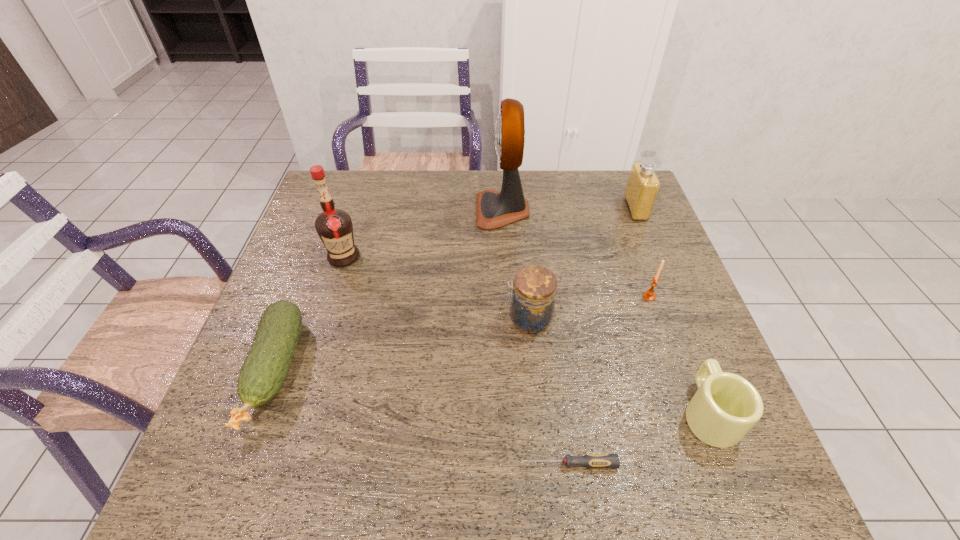
The height and width of the screenshot is (540, 960). In the image, there is a desktop. Find the location of `vacant area at the left edge`. vacant area at the left edge is located at coordinates (292, 416).

The height and width of the screenshot is (540, 960). In order to click on free spot at the right edge of the desktop in this screenshot , I will do `click(649, 255)`.

Find the location of `vacant space at the far left corner of the desktop`. vacant space at the far left corner of the desktop is located at coordinates (347, 206).

The width and height of the screenshot is (960, 540). I want to click on vacant space at the near left corner of the desktop, so click(x=263, y=450).

I want to click on vacant area between the candle_holder and the third shortest object, so click(x=679, y=354).

Where is `blank region between the third tallest object and the fan`? blank region between the third tallest object and the fan is located at coordinates (569, 210).

This screenshot has width=960, height=540. In order to click on unoccupied position between the perfume and the liquor in this screenshot , I will do `click(490, 233)`.

Identify the location of vacant area that lies between the jar and the fan. (516, 265).

Locate an element on the screen. This screenshot has height=540, width=960. free spot between the liquor and the fifth nearest object is located at coordinates (496, 276).

Where is `free space between the second shortest object and the screwdriver`? free space between the second shortest object and the screwdriver is located at coordinates (421, 417).